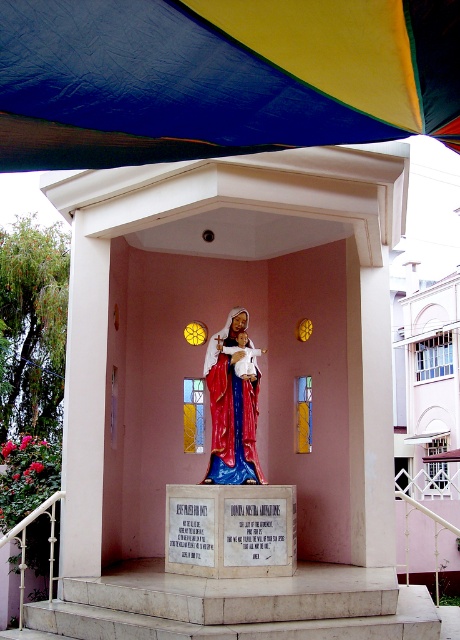
Question: Is white marble stairs at center positioned in front of polished wood statue at center?

Choices:
 (A) no
 (B) yes

Answer: (B)

Question: Estimate the real-world distances between objects in this image. Which object is closer to the polished wood statue at center?

Choices:
 (A) textured canvas canopy at upper center
 (B) white marble stairs at center

Answer: (B)

Question: Does white marble stairs at center have a larger size compared to polished wood statue at center?

Choices:
 (A) yes
 (B) no

Answer: (A)

Question: In this image, where is textured canvas canopy at upper center located relative to polished wood statue at center?

Choices:
 (A) above
 (B) below

Answer: (A)

Question: Which of these objects is positioned farthest from the polished wood statue at center?

Choices:
 (A) white marble stairs at center
 (B) textured canvas canopy at upper center

Answer: (B)

Question: Which point is farther from the camera taking this photo?

Choices:
 (A) (171, 625)
 (B) (298, 72)
 (C) (214, 470)

Answer: (C)